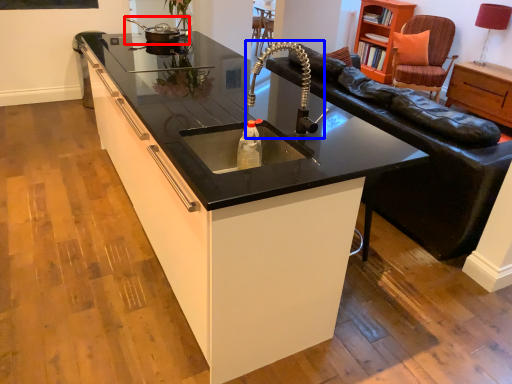
Question: Which of the following is the farthest to the observer, appliance (highlighted by a red box) or faucet (highlighted by a blue box)?

Choices:
 (A) appliance
 (B) faucet

Answer: (A)